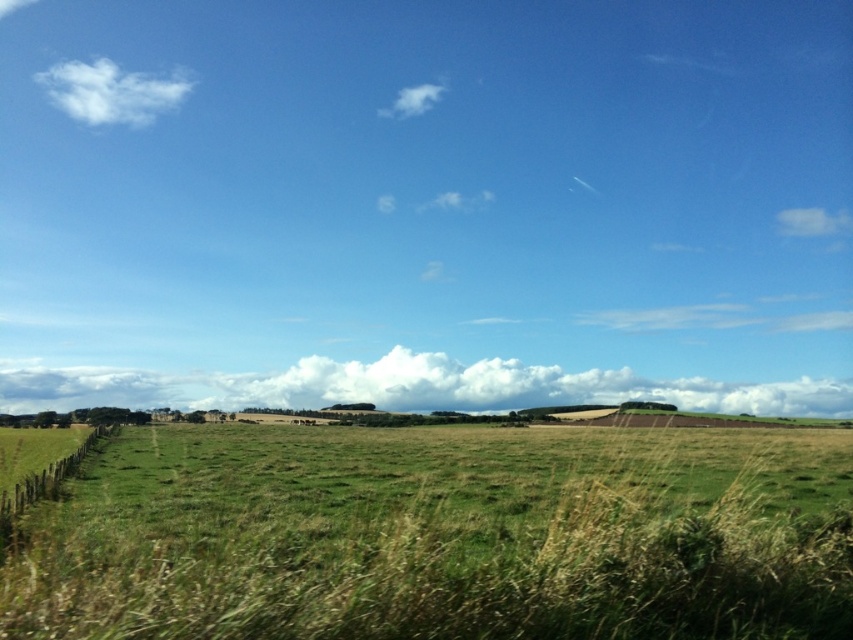
Question: Does green grassy field at center appear under white fluffy cloud at center?

Choices:
 (A) no
 (B) yes

Answer: (A)

Question: Which object is the farthest from the white fluffy cloud at upper center?

Choices:
 (A) white fluffy cloud at upper left
 (B) white fluffy cloud at upper right
 (C) white fluffy cloud at center

Answer: (B)

Question: Among these points, which one is farthest from the camera?

Choices:
 (A) (656, 554)
 (B) (103, 99)
 (C) (396, 115)
 (D) (833, 228)

Answer: (B)

Question: Which point is closer to the camera?

Choices:
 (A) (86, 124)
 (B) (403, 100)

Answer: (B)

Question: From the image, what is the correct spatial relationship of white fluffy cloud at upper right in relation to white fluffy cloud at upper center?

Choices:
 (A) left
 (B) right

Answer: (B)

Question: Is white fluffy cloud at upper left to the left of white fluffy cloud at upper right from the viewer's perspective?

Choices:
 (A) yes
 (B) no

Answer: (A)